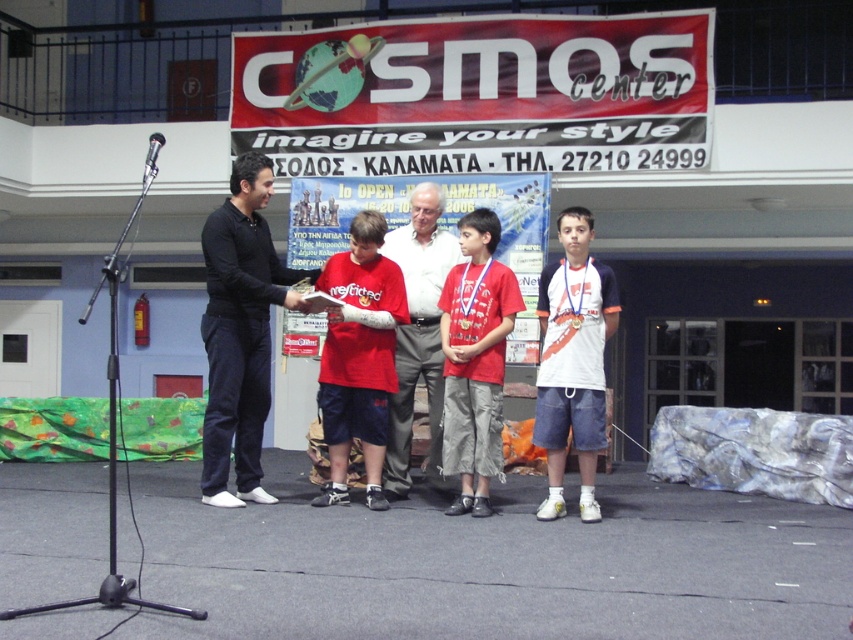
Question: Estimate the real-world distances between objects in this image. Which object is closer to the metallic silver microphone at upper left?

Choices:
 (A) white cotton t-shirt at center
 (B) red cotton shirt at center
 (C) red matte shirt at center
 (D) matte black shirt at center

Answer: (C)

Question: Which of these objects is positioned farthest from the metallic silver microphone at upper left?

Choices:
 (A) matte black shirt at center
 (B) red matte shirt at center
 (C) black matte shirt at left
 (D) white cotton t-shirt at center

Answer: (D)

Question: Which of the following is the closest to the observer?

Choices:
 (A) white cotton t-shirt at center
 (B) matte black shirt at center
 (C) red matte shirt at center
 (D) red cotton shirt at center

Answer: (A)

Question: Can you confirm if white cotton t-shirt at center is bigger than metallic silver microphone at upper left?

Choices:
 (A) yes
 (B) no

Answer: (A)

Question: Does matte black shirt at center appear on the left side of matte red shirt at center?

Choices:
 (A) yes
 (B) no

Answer: (B)

Question: Where is red matte shirt at center located in relation to metallic silver microphone at upper left in the image?

Choices:
 (A) below
 (B) above

Answer: (A)